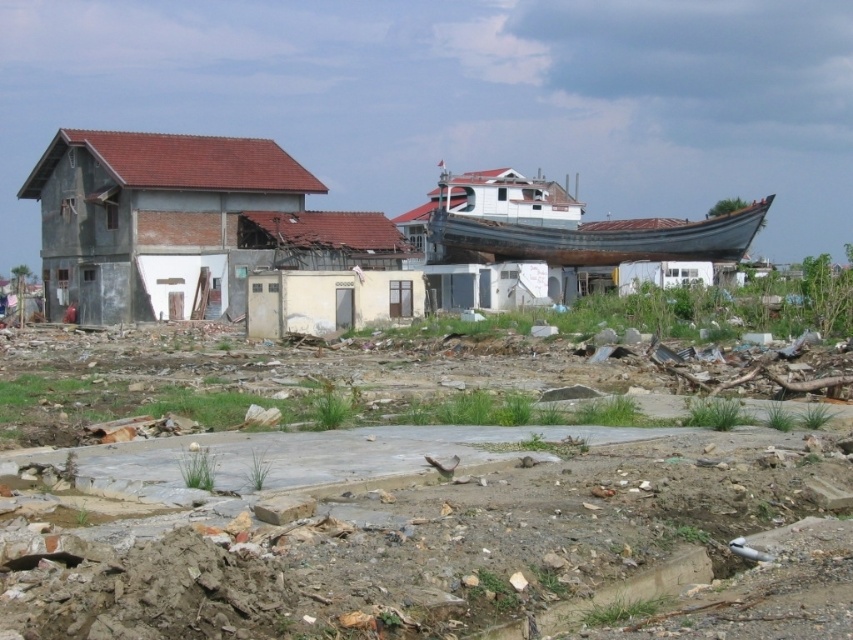
Question: Is gray concrete house at left positioned behind rusty metal boat at center?

Choices:
 (A) no
 (B) yes

Answer: (A)

Question: From the image, what is the correct spatial relationship of gray concrete house at left in relation to rusty metal boat at center?

Choices:
 (A) right
 (B) left

Answer: (B)

Question: Which of the following is the farthest from the observer?

Choices:
 (A) (726, 214)
 (B) (144, 166)

Answer: (A)

Question: From the image, what is the correct spatial relationship of gray concrete house at left in relation to rusty metal boat at center?

Choices:
 (A) above
 (B) below

Answer: (A)

Question: Which of the following is the closest to the observer?

Choices:
 (A) gray concrete house at left
 (B) rusty metal boat at center

Answer: (A)